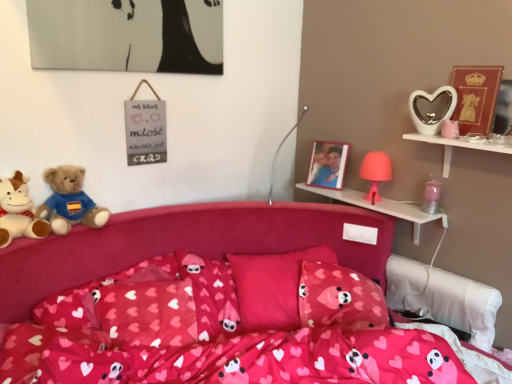
Where is `free space above pink plastic lamp at upper right, the first shelf from the back (from a real-world perspective)`? free space above pink plastic lamp at upper right, the first shelf from the back (from a real-world perspective) is located at coordinates (367, 198).